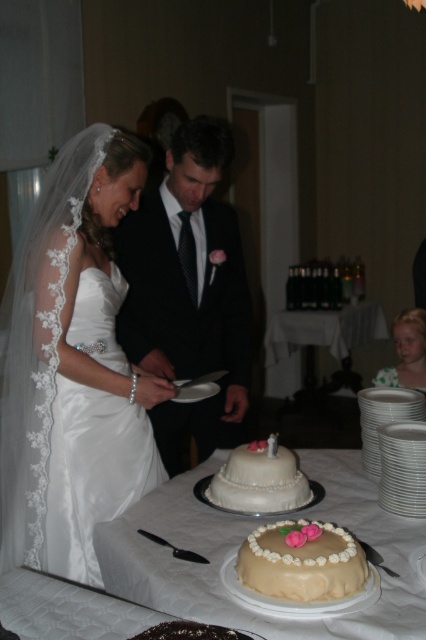
Question: Which object appears farthest from the camera in this image?

Choices:
 (A) polka dot dress at lower right
 (B) satin white dress at left
 (C) creamy fondant cake at center

Answer: (A)

Question: Which point is closer to the camera?

Choices:
 (A) smooth beige cake at center
 (B) white porcelain plates at center
 (C) white pearl cake at center
 (D) black satin suit at center

Answer: (A)

Question: Is creamy fondant cake at center positioned in front of white pearl cake at center?

Choices:
 (A) no
 (B) yes

Answer: (B)

Question: Does satin white dress at left have a smaller size compared to polka dot dress at lower right?

Choices:
 (A) no
 (B) yes

Answer: (A)

Question: In this image, where is creamy fondant cake at center located relative to polka dot dress at lower right?

Choices:
 (A) below
 (B) above

Answer: (A)

Question: Based on their relative distances, which object is nearer to the satin white dress at left?

Choices:
 (A) white porcelain plates at center
 (B) polka dot dress at lower right

Answer: (B)